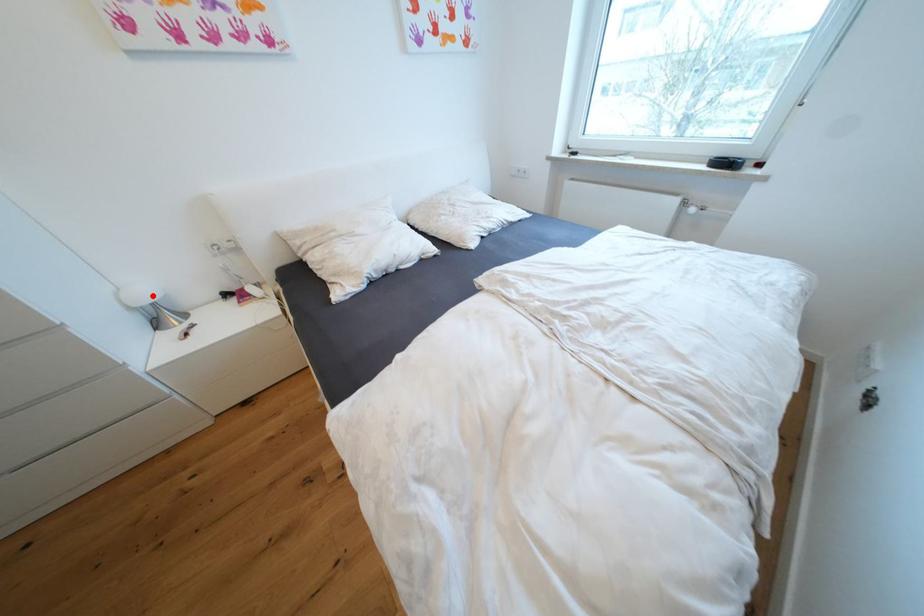
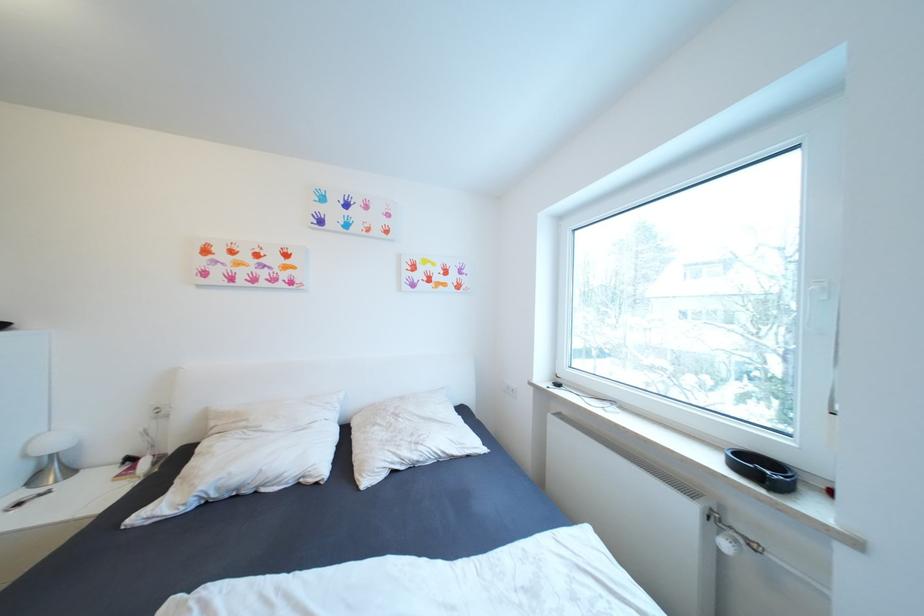
In the second image, find the point that corresponds to the highlighted location in the first image.

(63, 445)